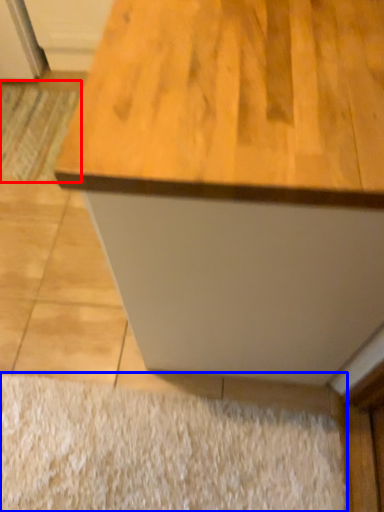
Question: Among these objects, which one is farthest to the camera, doormat (highlighted by a red box) or doormat (highlighted by a blue box)?

Choices:
 (A) doormat
 (B) doormat

Answer: (A)